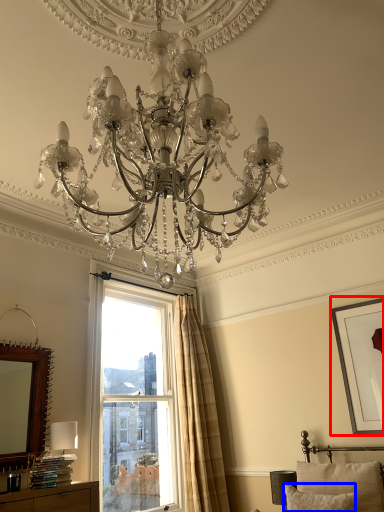
Question: Which object appears farthest to the camera in this image, picture frame (highlighted by a red box) or pillow (highlighted by a blue box)?

Choices:
 (A) picture frame
 (B) pillow

Answer: (A)